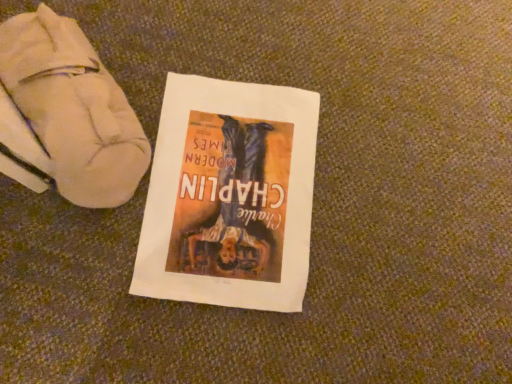
The width and height of the screenshot is (512, 384). What do you see at coordinates (65, 114) in the screenshot?
I see `white fabric boot at upper left` at bounding box center [65, 114].

Where is `white fabric boot at upper left`? This screenshot has width=512, height=384. white fabric boot at upper left is located at coordinates (65, 114).

Locate an element on the screen. white fabric boot at upper left is located at coordinates (65, 114).